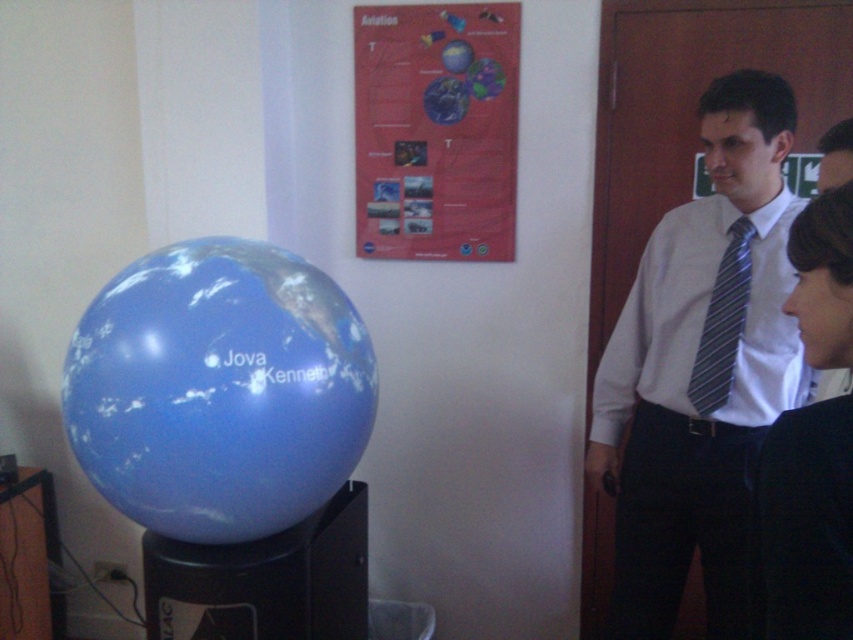
Question: Is white shirt with tie at right thinner than blue glossy globe at left?

Choices:
 (A) no
 (B) yes

Answer: (B)

Question: Based on their relative distances, which object is nearer to the white shirt with tie at right?

Choices:
 (A) black fabric business suit at lower right
 (B) striped fabric tie at center
 (C) blue glossy globe at left
 (D) red paper poster at upper center

Answer: (B)

Question: Which object appears closest to the camera in this image?

Choices:
 (A) white shirt with tie at right
 (B) striped fabric tie at center

Answer: (A)

Question: Which object appears farthest from the camera in this image?

Choices:
 (A) white shirt with tie at right
 (B) striped fabric tie at center
 (C) blue glossy globe at left
 (D) black fabric business suit at lower right

Answer: (B)

Question: Is white shirt with tie at right to the left of red paper poster at upper center from the viewer's perspective?

Choices:
 (A) yes
 (B) no

Answer: (B)

Question: Can you confirm if white shirt with tie at right is positioned to the right of blue glossy globe at left?

Choices:
 (A) no
 (B) yes

Answer: (B)